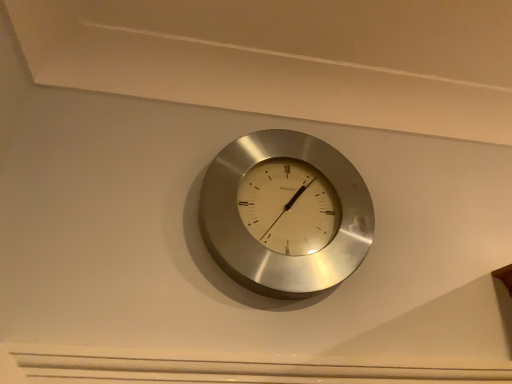
This screenshot has width=512, height=384. I want to click on satin silver clock at center, so click(267, 249).

Describe the element at coordinates (267, 249) in the screenshot. I see `satin silver clock at center` at that location.

This screenshot has height=384, width=512. What are the coordinates of `satin silver clock at center` in the screenshot? It's located at 267,249.